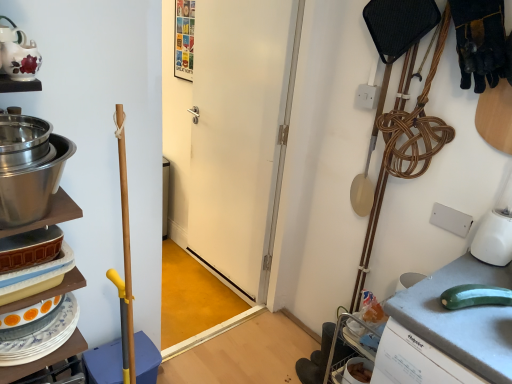
Question: Is matte ceramic teapot at upper left looking in the opposite direction of stainless steel bowl at left?

Choices:
 (A) yes
 (B) no

Answer: (B)

Question: Considering the relative sizes of matte ceramic teapot at upper left and stainless steel bowl at left in the image provided, is matte ceramic teapot at upper left wider than stainless steel bowl at left?

Choices:
 (A) no
 (B) yes

Answer: (A)

Question: Can you confirm if matte ceramic teapot at upper left is taller than stainless steel bowl at left?

Choices:
 (A) yes
 (B) no

Answer: (B)

Question: Considering the relative sizes of matte ceramic teapot at upper left and stainless steel bowl at left in the image provided, is matte ceramic teapot at upper left bigger than stainless steel bowl at left?

Choices:
 (A) yes
 (B) no

Answer: (B)

Question: Is the depth of matte ceramic teapot at upper left less than that of stainless steel bowl at left?

Choices:
 (A) no
 (B) yes

Answer: (A)

Question: Is matte ceramic teapot at upper left to the right of stainless steel bowl at left from the viewer's perspective?

Choices:
 (A) no
 (B) yes

Answer: (A)

Question: Does matte ceramic teapot at upper left lie in front of white matte door at center?

Choices:
 (A) no
 (B) yes

Answer: (B)

Question: Is matte ceramic teapot at upper left located outside white matte door at center?

Choices:
 (A) yes
 (B) no

Answer: (A)

Question: Is matte ceramic teapot at upper left smaller than white matte door at center?

Choices:
 (A) no
 (B) yes

Answer: (B)

Question: Does matte ceramic teapot at upper left appear on the right side of white matte door at center?

Choices:
 (A) no
 (B) yes

Answer: (A)

Question: Is matte ceramic teapot at upper left oriented towards white matte door at center?

Choices:
 (A) no
 (B) yes

Answer: (A)

Question: Is matte ceramic teapot at upper left behind white matte door at center?

Choices:
 (A) no
 (B) yes

Answer: (A)

Question: Is stainless steel bowl at left located outside matte ceramic teapot at upper left?

Choices:
 (A) yes
 (B) no

Answer: (A)